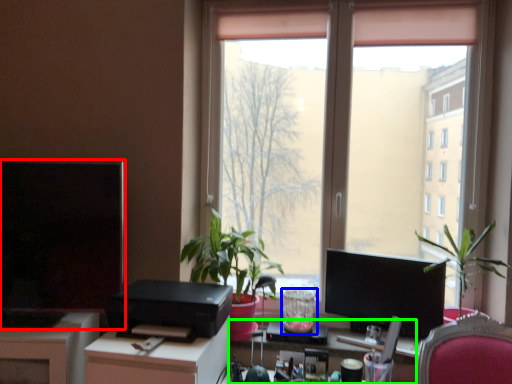
Question: Based on their relative distances, which object is farther from computer monitor (highlighted by a red box)? Choose from glass vase (highlighted by a blue box) and computer desk (highlighted by a green box).

Choices:
 (A) glass vase
 (B) computer desk

Answer: (A)